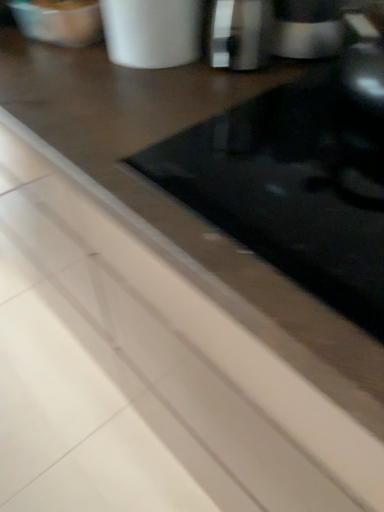
Find the location of `vacant space that is to the left of metallic silver cup at upper center`. vacant space that is to the left of metallic silver cup at upper center is located at coordinates (52, 67).